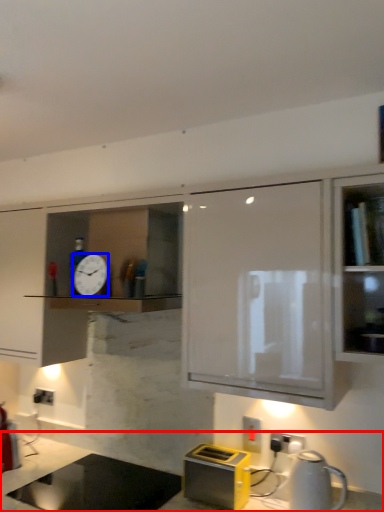
Question: Which object appears farthest to the camera in this image, countertop (highlighted by a red box) or clock (highlighted by a blue box)?

Choices:
 (A) countertop
 (B) clock

Answer: (B)